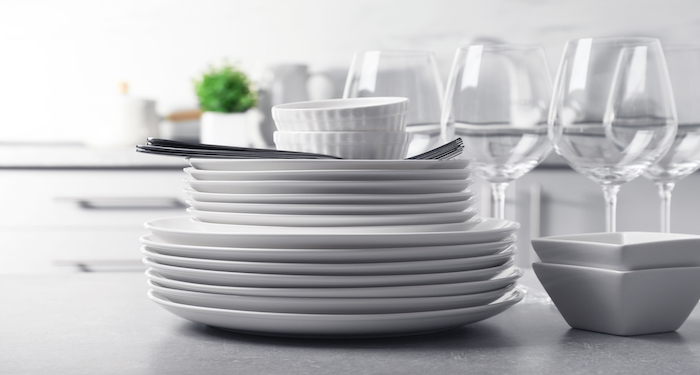
Image resolution: width=700 pixels, height=375 pixels. I want to click on plant, so click(222, 87), click(227, 105), click(204, 92), click(238, 82).